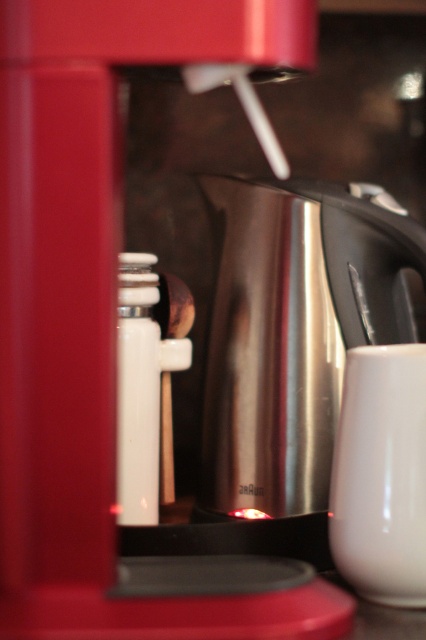
Which is behind, point (270, 193) or point (377, 477)?

Point (270, 193)

Locate an element on the screen. The height and width of the screenshot is (640, 426). stainless steel coffee pot at center is located at coordinates (293, 332).